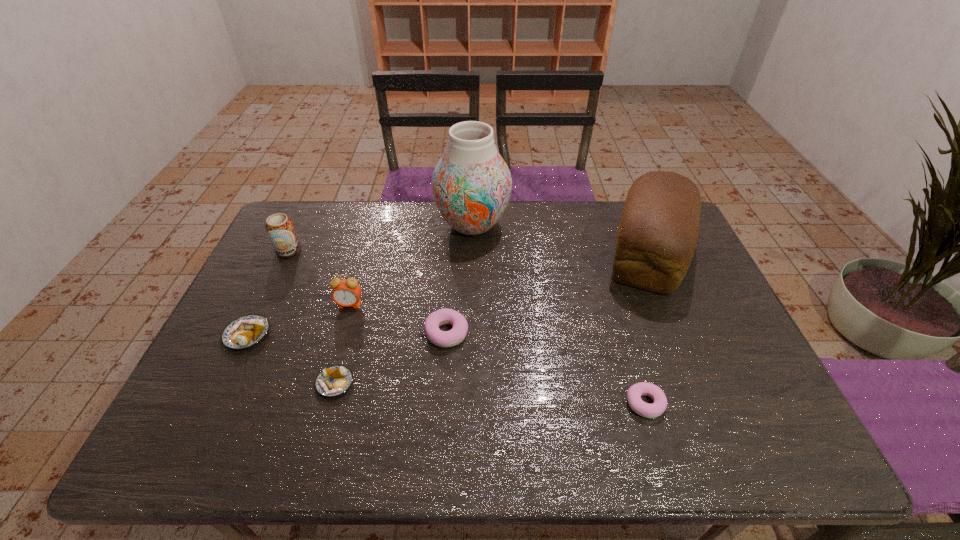
Locate an element on the screen. free region located on the right of the nearer brown pastry is located at coordinates (501, 383).

You are a GUI agent. You are given a task and a screenshot of the screen. Output one action in this format:
    pyautogui.click(x=<x>, y=<y>)
    Task: Click on the vase that is at the far edge
    
    Given the screenshot: What is the action you would take?
    pyautogui.click(x=471, y=184)

At what (x,y) coordinates should I click in order to perform the action: click on bread that is positioned at the far edge. Please return your answer as a coordinate pair (x, y). Looking at the image, I should click on (657, 235).

At what (x,y) coordinates should I click in order to perform the action: click on beer can at the far edge. Please return your answer as a coordinate pair (x, y). This screenshot has height=540, width=960. Looking at the image, I should click on (279, 227).

What are the coordinates of `beer can present at the left edge` in the screenshot? It's located at (279, 227).

Find the location of `pastry located in the left edge section of the desktop`. pastry located in the left edge section of the desktop is located at coordinates (246, 331).

This screenshot has width=960, height=540. What are the coordinates of `object present at the right edge` in the screenshot? It's located at (657, 235).

This screenshot has width=960, height=540. What are the coordinates of `object at the far left corner` in the screenshot? It's located at (279, 227).

The width and height of the screenshot is (960, 540). I want to click on object that is at the far right corner, so click(657, 235).

The width and height of the screenshot is (960, 540). In order to click on free space at the far edge in this screenshot , I will do `click(428, 214)`.